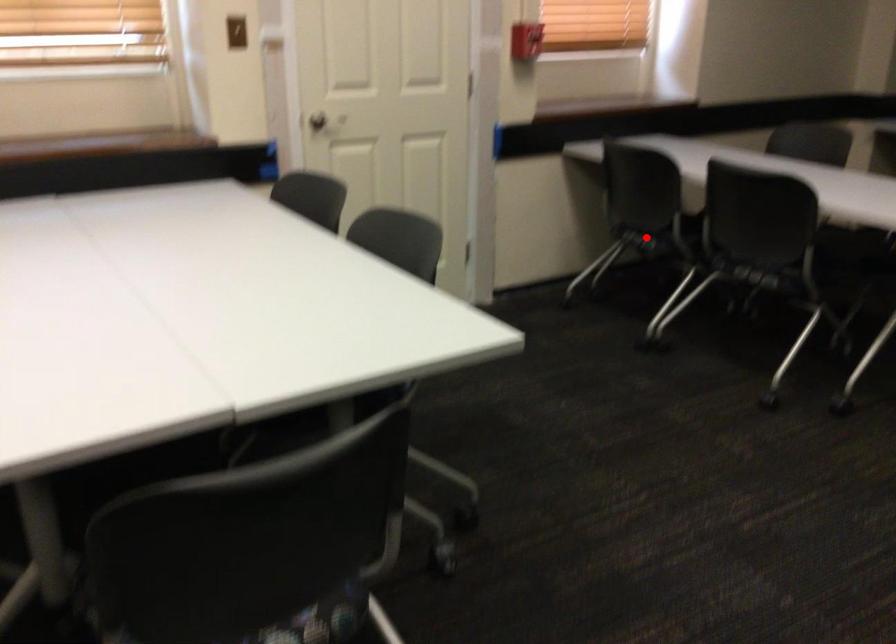
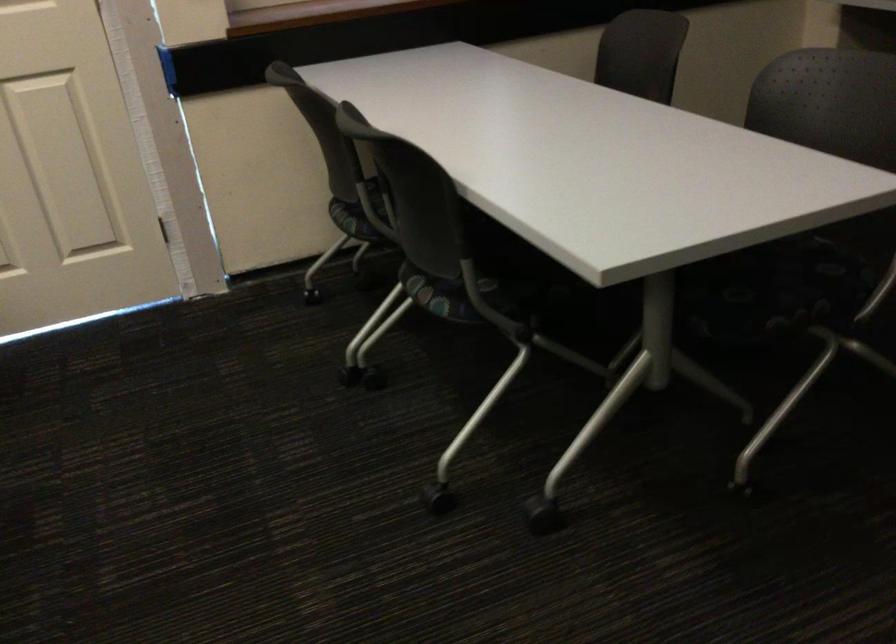
Question: I am providing you with two images of the same scene from different viewpoints. A red point is shown in image1. For the corresponding object point in image2, is it positioned nearer or farther from the camera?

Choices:
 (A) Nearer
 (B) Farther

Answer: (A)